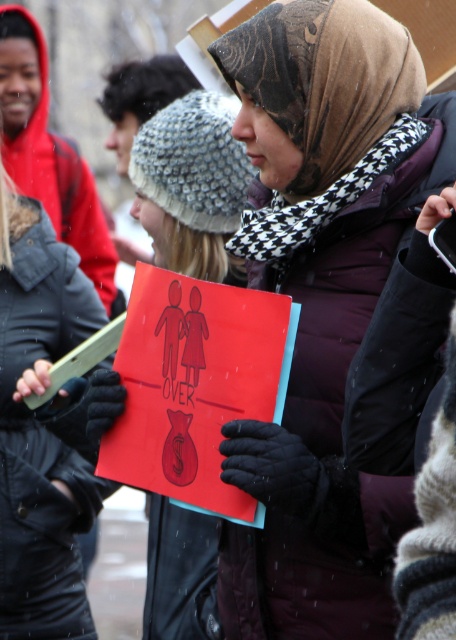
You are a photographer trying to capture a clear shot of both the matte purple jacket at center and the matte black jacket at left. Since you want both jackets to appear equally prominent in the photo, which jacket should you zoom in on more?

The matte purple jacket at center is larger in size than the matte black jacket at left, so you should zoom in more on the matte black jacket at left to balance their prominence in the photo.

You are a photographer trying to capture a closeup of the red sign held by the woman in the purple puffer jacket. The camera you are using has a limited field of view. Can you determine if the point at coordinates point at point (321, 304) is on the red sign or on the purple jacket?

The point at point (321, 304) is on the matte purple jacket at center, so it is not on the red sign.

You are a photographer trying to capture a photo of the matte purple jacket at center and the matte black jacket at left. Based on their positions, which jacket should you focus on first if you want to frame them from left to right?

The matte black jacket at left should be focused on first since it is positioned to the left of the matte purple jacket at center, making it the leftmost object in the frame.